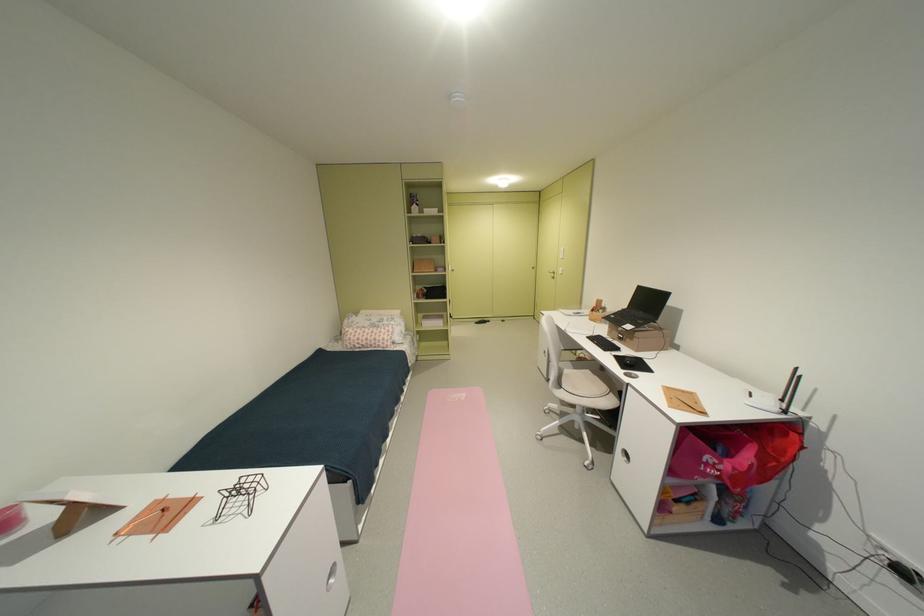
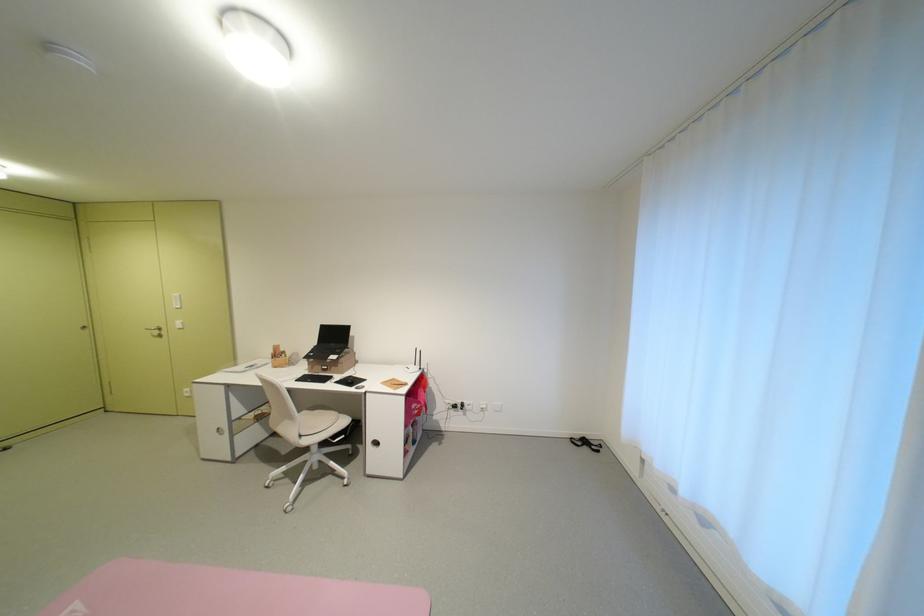
Where in the second image is the point corresponding to point 558,274 from the first image?

(156, 331)